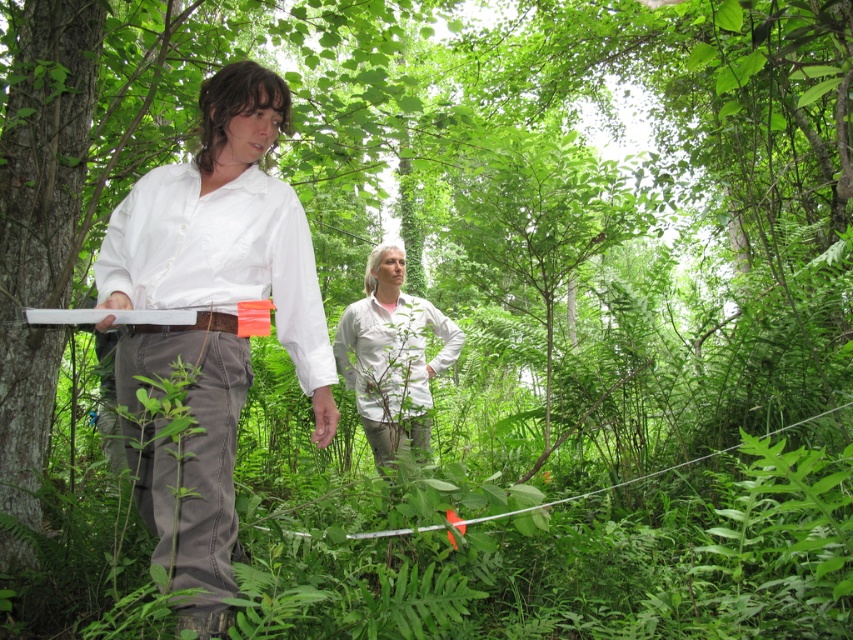
Question: Among these points, which one is farthest from the camera?

Choices:
 (A) (344, 317)
 (B) (122, 227)
 (C) (103, 259)

Answer: (A)

Question: Does white cotton shirt at center have a smaller size compared to white matte shirt at left?

Choices:
 (A) no
 (B) yes

Answer: (A)

Question: Which of the following is the farthest from the observer?

Choices:
 (A) white matte shirt at left
 (B) white matte shirt at center
 (C) white cotton shirt at center

Answer: (B)

Question: Is white matte shirt at left below white matte shirt at center?

Choices:
 (A) yes
 (B) no

Answer: (B)

Question: Among these objects, which one is farthest from the camera?

Choices:
 (A) white matte shirt at center
 (B) white matte shirt at left

Answer: (A)

Question: Can you confirm if white matte shirt at left is positioned to the left of white matte shirt at center?

Choices:
 (A) no
 (B) yes

Answer: (B)